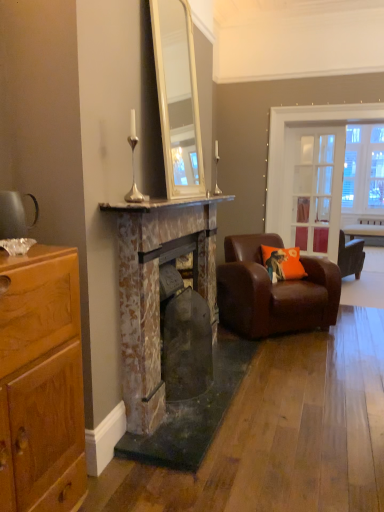
Where is `vacant space situated above clear glass door at center (from a real-world perspective)`? vacant space situated above clear glass door at center (from a real-world perspective) is located at coordinates (330, 123).